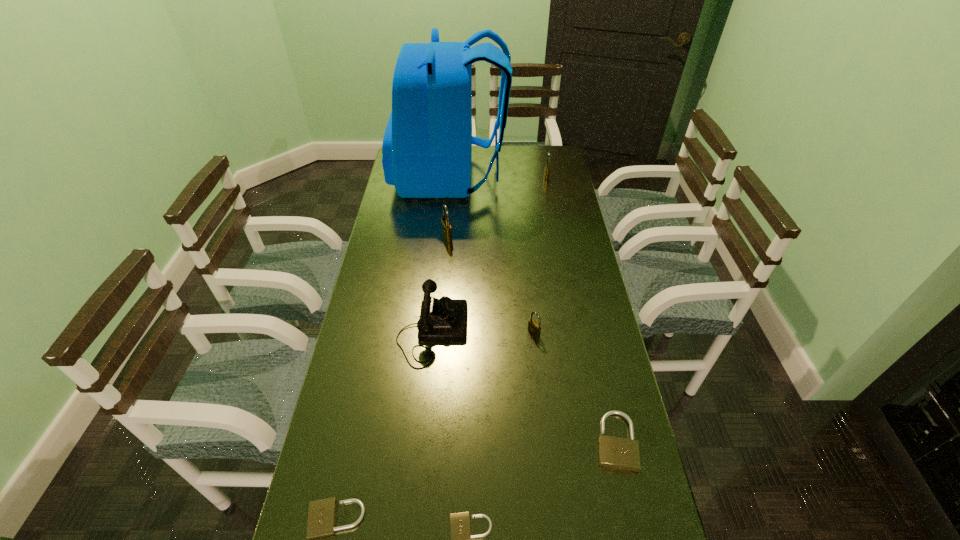
Locate an element on the screen. The width and height of the screenshot is (960, 540). brass padlock that is the closest to the leftmost brass padlock is located at coordinates (534, 328).

Locate which beige padlock is the second closest to the leftmost beige padlock. Please provide its 2D coordinates. Your answer should be formatted as a tuple, i.e. [(x, y)], where the tuple contains the x and y coordinates of a point satisfying the conditions above.

[(619, 453)]

I want to click on the closest beige padlock relative to the telephone, so click(321, 522).

You are a GUI agent. You are given a task and a screenshot of the screen. Output one action in this format:
    pyautogui.click(x=<x>, y=<y>)
    Task: Click on the free location that satisfies the following two spatial constraints: 1. on the back of the farthest beige padlock; 2. on the left side of the backpack
    
    Given the screenshot: What is the action you would take?
    426,441

I want to click on free location that satisfies the following two spatial constraints: 1. on the back of the tallest object; 2. on the back side of the smallest brass padlock, so click(x=436, y=333).